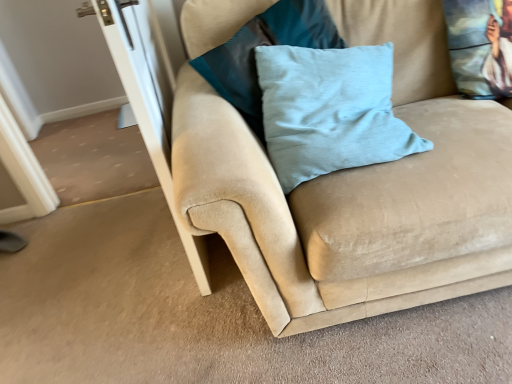
You are a GUI agent. You are given a task and a screenshot of the screen. Output one action in this format:
    pyautogui.click(x=<x>, y=<y>)
    Task: Click on the free space in front of transparent glass screen door at left
    The height and width of the screenshot is (384, 512).
    Given the screenshot: What is the action you would take?
    pyautogui.click(x=187, y=323)